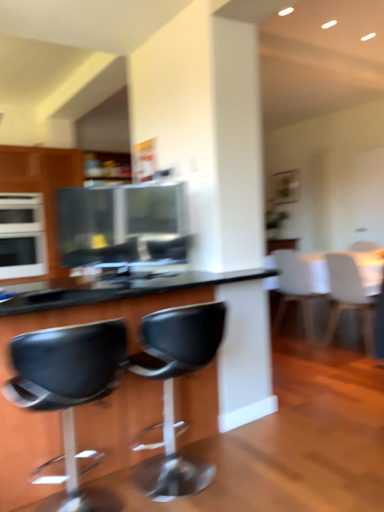
Question: Would you say white glossy oven at left, which appears as the second appliance when viewed from the front, is a long distance from metallic silver microwave at center, which ranks as the 1th appliance in right-to-left order?

Choices:
 (A) yes
 (B) no

Answer: (A)

Question: Is white glossy oven at left, the 1th appliance from the back, oriented towards metallic silver microwave at center, which ranks as the 1th appliance in right-to-left order?

Choices:
 (A) no
 (B) yes

Answer: (B)

Question: Can you confirm if white glossy oven at left, the 1th appliance from the left, is wider than metallic silver microwave at center, the 1th appliance positioned from the front?

Choices:
 (A) yes
 (B) no

Answer: (A)

Question: From a real-world perspective, is white glossy oven at left, the 1th appliance from the left, under metallic silver microwave at center, acting as the 2th appliance starting from the left?

Choices:
 (A) yes
 (B) no

Answer: (A)

Question: Is metallic silver microwave at center, arranged as the second appliance when viewed from the back, a part of white glossy oven at left, which appears as the second appliance when viewed from the front?

Choices:
 (A) yes
 (B) no

Answer: (B)

Question: Does white glossy oven at left, the 1th appliance from the left, have a greater height compared to metallic silver microwave at center, the 1th appliance positioned from the front?

Choices:
 (A) yes
 (B) no

Answer: (A)

Question: Does metallic silver microwave at center, arranged as the second appliance when viewed from the back, appear on the left side of black leather stool at lower left, arranged as the 1th chair when viewed from the front?

Choices:
 (A) yes
 (B) no

Answer: (B)

Question: Can you confirm if metallic silver microwave at center, the 1th appliance positioned from the front, is taller than black leather stool at lower left, the first chair from the left?

Choices:
 (A) yes
 (B) no

Answer: (B)

Question: From the image's perspective, would you say metallic silver microwave at center, acting as the 2th appliance starting from the left, is shown under black leather stool at lower left, the first chair from the left?

Choices:
 (A) no
 (B) yes

Answer: (A)

Question: Is metallic silver microwave at center, which ranks as the 1th appliance in right-to-left order, to the right of black leather stool at lower left, placed as the fourth chair when sorted from right to left, from the viewer's perspective?

Choices:
 (A) yes
 (B) no

Answer: (A)

Question: Can you confirm if metallic silver microwave at center, acting as the 2th appliance starting from the left, is shorter than black leather stool at lower left, arranged as the 1th chair when viewed from the front?

Choices:
 (A) no
 (B) yes

Answer: (B)

Question: Is black leather stool at lower left, placed as the fourth chair when sorted from right to left, a part of metallic silver microwave at center, acting as the 2th appliance starting from the left?

Choices:
 (A) yes
 (B) no

Answer: (B)

Question: From a real-world perspective, is white glossy table at upper right, placed as the 2th table when sorted from left to right, over white matte chair at right, the 3th chair in the left-to-right sequence?

Choices:
 (A) yes
 (B) no

Answer: (A)